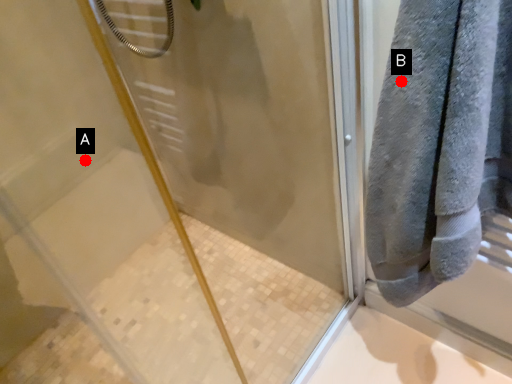
Question: Two points are circled on the image, labeled by A and B beside each circle. Which point appears closest to the camera in this image?

Choices:
 (A) A is closer
 (B) B is closer

Answer: (B)